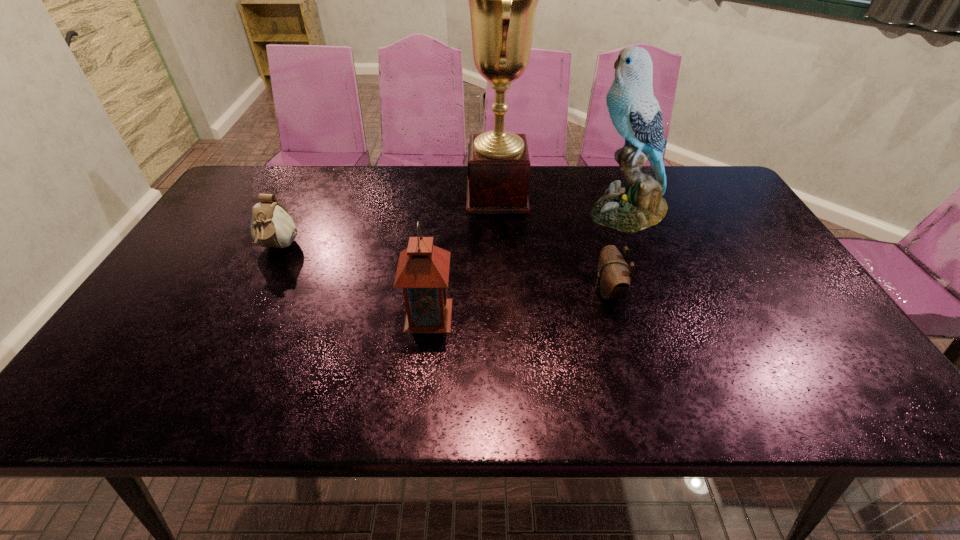
I want to click on trophy cup that is at the far edge, so click(x=503, y=0).

The image size is (960, 540). What are the coordinates of `parakeet situated at the far edge` in the screenshot? It's located at (635, 113).

Where is `vacant position at the far edge of the desktop`? The image size is (960, 540). vacant position at the far edge of the desktop is located at coordinates (333, 191).

Locate an element on the screen. The height and width of the screenshot is (540, 960). vacant space at the near edge of the desktop is located at coordinates (375, 393).

This screenshot has width=960, height=540. I want to click on vacant space at the left edge, so click(250, 234).

What are the coordinates of `free space at the right edge of the desktop` in the screenshot? It's located at (746, 276).

Find the location of `blank space at the far left corner of the desktop`. blank space at the far left corner of the desktop is located at coordinates (270, 193).

Where is `free space at the near left corner of the desktop`? Image resolution: width=960 pixels, height=540 pixels. free space at the near left corner of the desktop is located at coordinates (119, 401).

You are a GUI agent. You are given a task and a screenshot of the screen. Output one action in this format:
    pyautogui.click(x=<x>, y=<y>)
    Task: Click on the vacant space at the far right corner
    Image resolution: width=960 pixels, height=540 pixels.
    Given the screenshot: What is the action you would take?
    pyautogui.click(x=713, y=173)

Image resolution: width=960 pixels, height=540 pixels. I want to click on free point between the third object from right to left and the second object from left to right, so click(x=463, y=255).